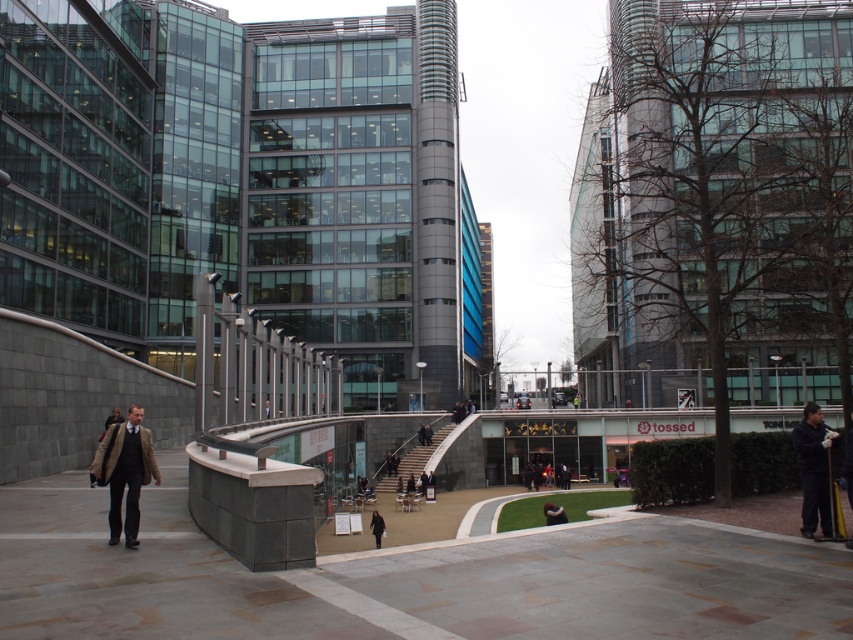
You are a fashion designer observing two coats in an urban setting. You see a brown wool coat at center and a white matte jacket at center. Which one is located to the left when viewed from the front?

The brown wool coat at center is positioned on the left side of the white matte jacket at center, so it is located to the left when viewed from the front.